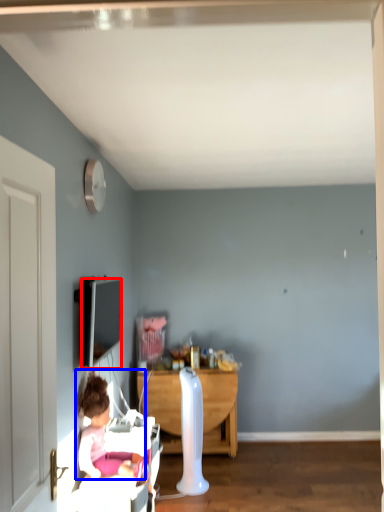
Question: Which of the following is the closest to the observer, television (highlighted by a red box) or person (highlighted by a blue box)?

Choices:
 (A) television
 (B) person

Answer: (B)